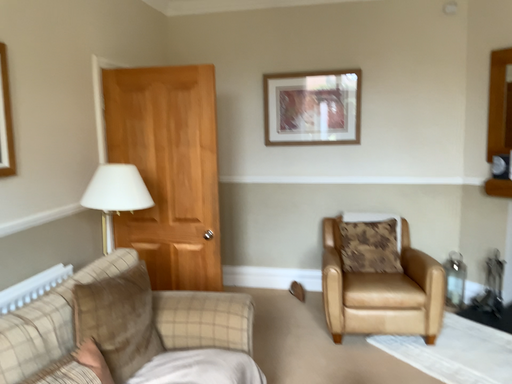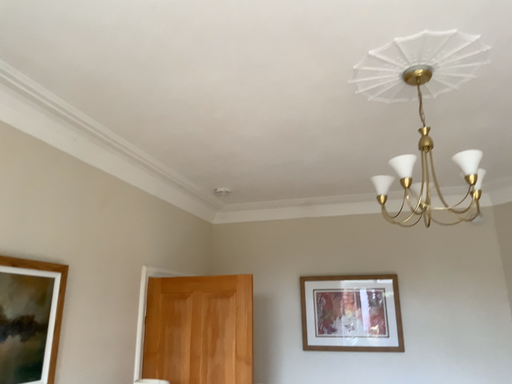
Question: How did the camera likely rotate when shooting the video?

Choices:
 (A) rotated downward
 (B) rotated upward

Answer: (B)